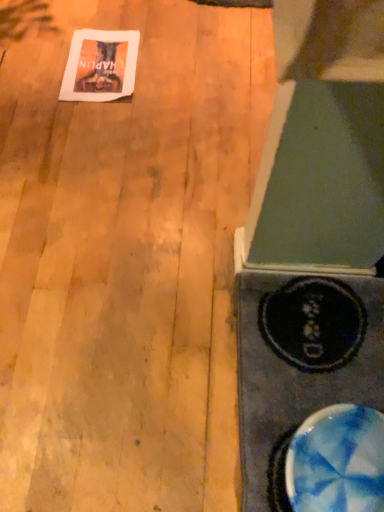
Locate an element on the screen. The image size is (384, 512). free spot above white paper at upper left (from a real-world perspective) is located at coordinates (101, 65).